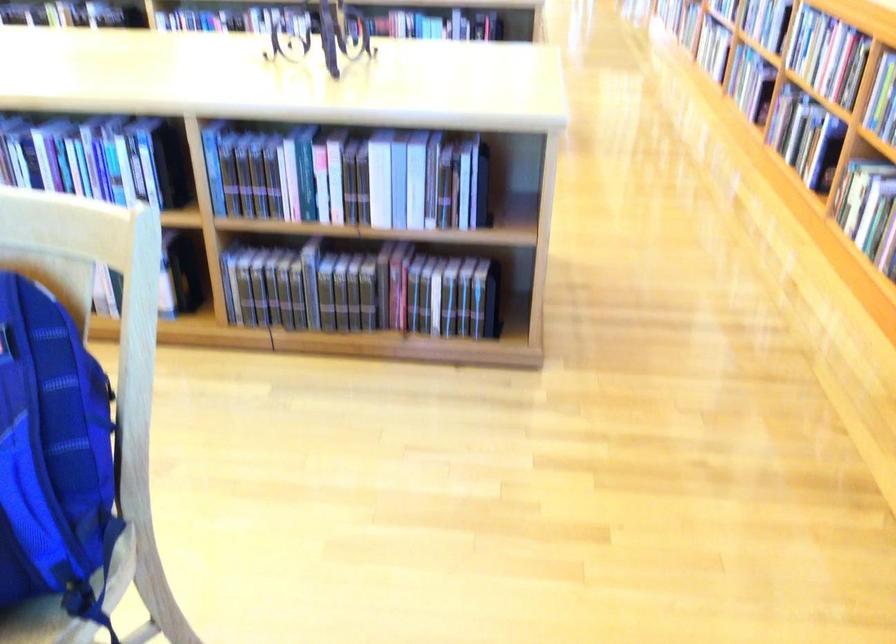
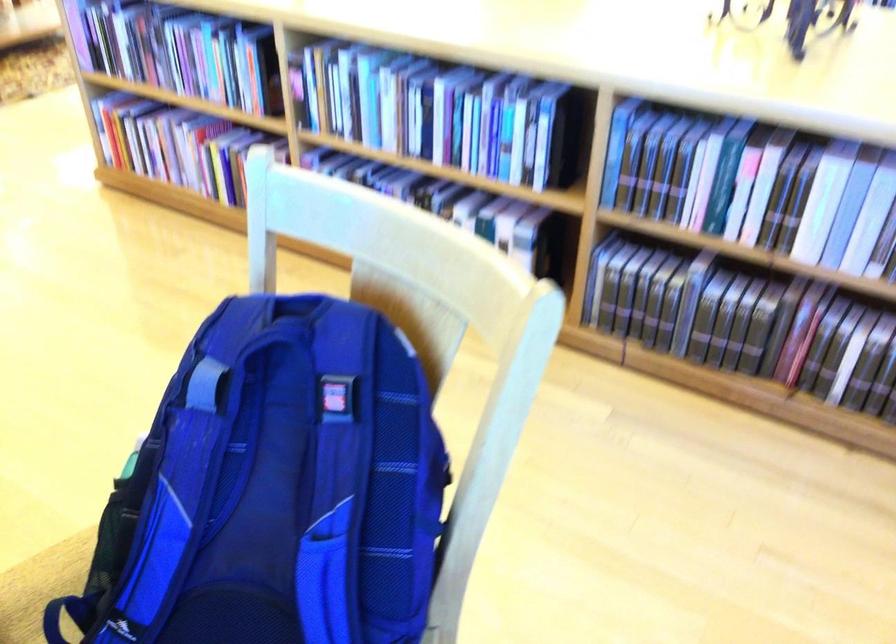
Question: Based on the continuous images, in which direction is the camera rotating? Reply with the corresponding letter.

Choices:
 (A) Left
 (B) Right
 (C) Up
 (D) Down

Answer: (A)